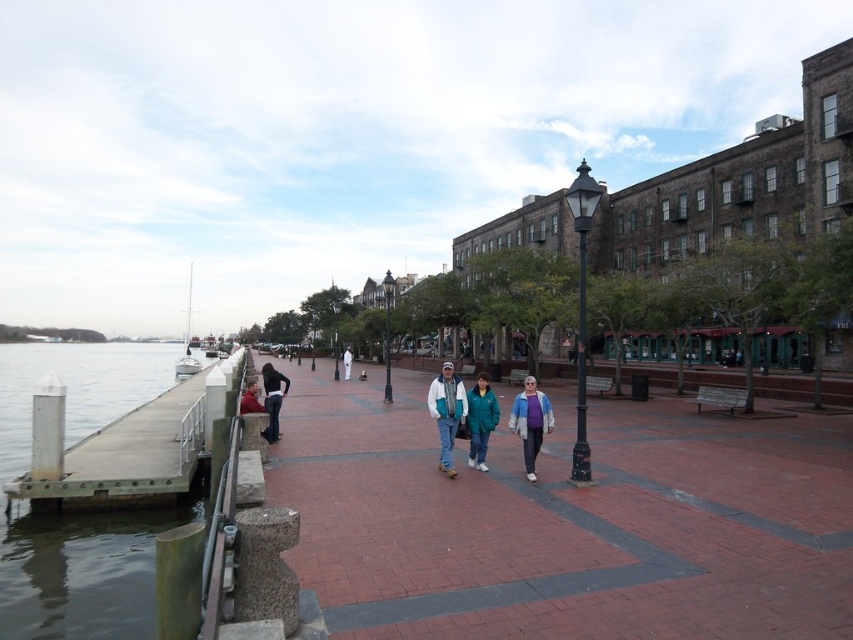
You are a photographer setting up a tripod on the promenade. The matte blue jacket at center and denim pants at center are in your shot. To avoid both, you need to move the tripod sideways. Which direction should you move it to first avoid the wider object?

The matte blue jacket at center might be wider than denim pants at center, so you should first move the tripod away from the matte blue jacket at center to avoid it first.

You are standing at point (x=349, y=362) and want to walk to the wooden pier on the left side of the image. Is the point (x=622, y=541) located in front of or behind you as you face the pier?

Point (x=622, y=541) is in front of point (x=349, y=362), so it is located in front of you as you face the pier.